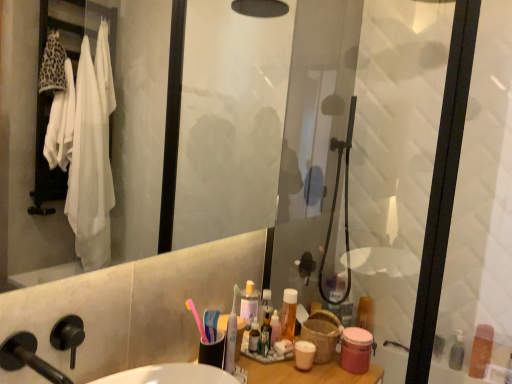
Question: Could transparent glass shower door at right be considered to be inside pink matte jar at lower right, placed as the 3th toiletry when sorted from right to left?

Choices:
 (A) no
 (B) yes

Answer: (A)

Question: From the image's perspective, would you say pink matte jar at lower right, the fourth toiletry when ordered from back to front, is positioned over transparent glass shower door at right?

Choices:
 (A) yes
 (B) no

Answer: (B)

Question: Considering the relative sizes of pink matte jar at lower right, the fourth toiletry when ordered from back to front, and transparent glass shower door at right in the image provided, is pink matte jar at lower right, the fourth toiletry when ordered from back to front, wider than transparent glass shower door at right?

Choices:
 (A) no
 (B) yes

Answer: (B)

Question: Does pink matte jar at lower right, placed as the 3th toiletry when sorted from right to left, come in front of transparent glass shower door at right?

Choices:
 (A) no
 (B) yes

Answer: (A)

Question: From the image's perspective, is pink matte jar at lower right, the fourth toiletry when ordered from back to front, located beneath transparent glass shower door at right?

Choices:
 (A) no
 (B) yes

Answer: (B)

Question: Considering their positions, is black matte faucet at lower left located in front of or behind translucent plastic bottle at lower right, the 4th toiletry when ordered from left to right?

Choices:
 (A) front
 (B) behind

Answer: (A)

Question: Is black matte faucet at lower left wider or thinner than translucent plastic bottle at lower right, the 4th toiletry when ordered from left to right?

Choices:
 (A) thin
 (B) wide

Answer: (B)

Question: Is black matte faucet at lower left bigger or smaller than translucent plastic bottle at lower right, placed as the first toiletry when sorted from right to left?

Choices:
 (A) big
 (B) small

Answer: (B)

Question: From the image's perspective, is black matte faucet at lower left positioned above or below translucent plastic bottle at lower right, the third toiletry from the front?

Choices:
 (A) above
 (B) below

Answer: (A)

Question: From a real-world perspective, relative to black matte faucet at lower left, is pink matte jar at lower right, placed as the 3th toiletry when sorted from right to left, vertically above or below?

Choices:
 (A) below
 (B) above

Answer: (A)

Question: Is pink matte jar at lower right, the 2th toiletry when ordered from left to right, situated inside black matte faucet at lower left or outside?

Choices:
 (A) outside
 (B) inside

Answer: (A)

Question: Is point (343, 332) closer or farther from the camera than point (7, 369)?

Choices:
 (A) farther
 (B) closer

Answer: (A)

Question: From the image's perspective, is pink matte jar at lower right, placed as the first toiletry when sorted from front to back, positioned above or below black matte faucet at lower left?

Choices:
 (A) above
 (B) below

Answer: (B)

Question: Choose the correct answer: Is white plastic toothbrush at center inside matte plastic container at right, the 4th toiletry positioned from the front, or outside it?

Choices:
 (A) outside
 (B) inside

Answer: (A)

Question: Looking at their shapes, would you say white plastic toothbrush at center is wider or thinner than matte plastic container at right, which is the 1th toiletry from back to front?

Choices:
 (A) thin
 (B) wide

Answer: (A)